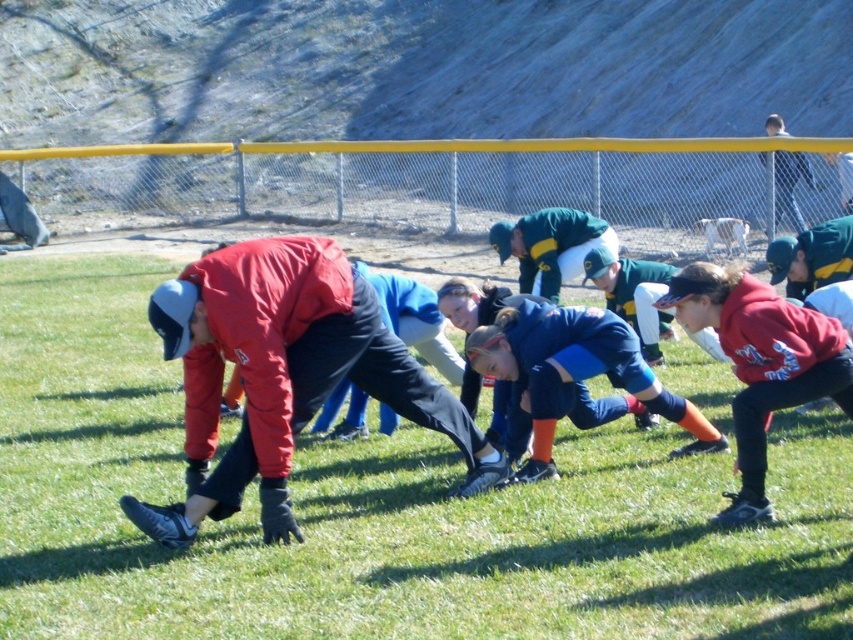
Question: Does matte red jacket at center come in front of matte red hoodie at right?

Choices:
 (A) no
 (B) yes

Answer: (A)

Question: Based on their relative distances, which object is farther from the matte red hoodie at right?

Choices:
 (A) green grass at center
 (B) matte red jacket at center

Answer: (B)

Question: Based on their relative distances, which object is farther from the matte red hoodie at right?

Choices:
 (A) matte red jacket at center
 (B) green grass at center

Answer: (A)

Question: Can you confirm if green grass at center is positioned below matte red hoodie at right?

Choices:
 (A) yes
 (B) no

Answer: (A)

Question: Considering the real-world distances, which object is closest to the green grass at center?

Choices:
 (A) matte red hoodie at right
 (B) matte red jacket at center

Answer: (B)

Question: Does matte red jacket at center come behind matte red hoodie at right?

Choices:
 (A) no
 (B) yes

Answer: (B)